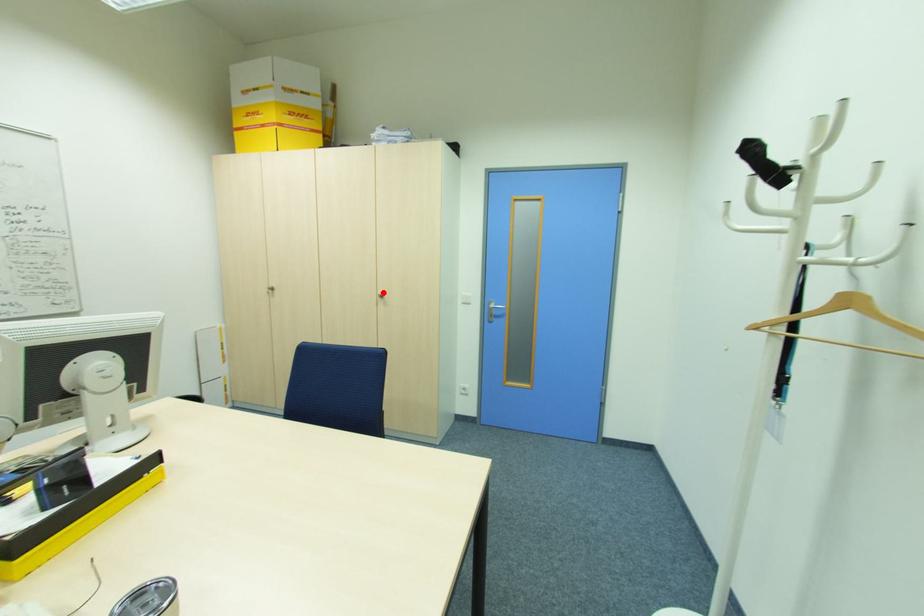
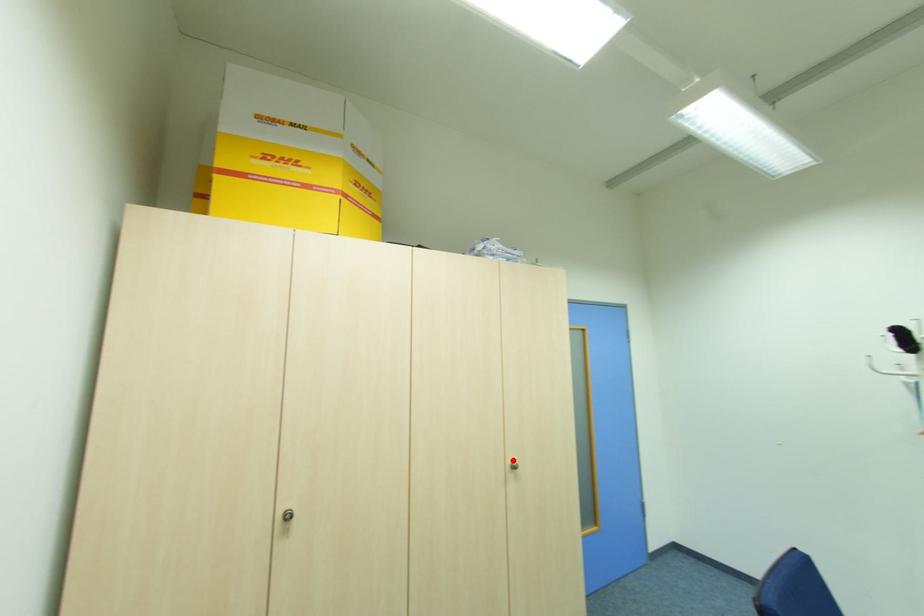
I am providing you with two images of the same scene from different viewpoints. A red point is marked on the first image and another point is marked on the second image. Are the points marked in image1 and image2 representing the same 3D position?

Yes